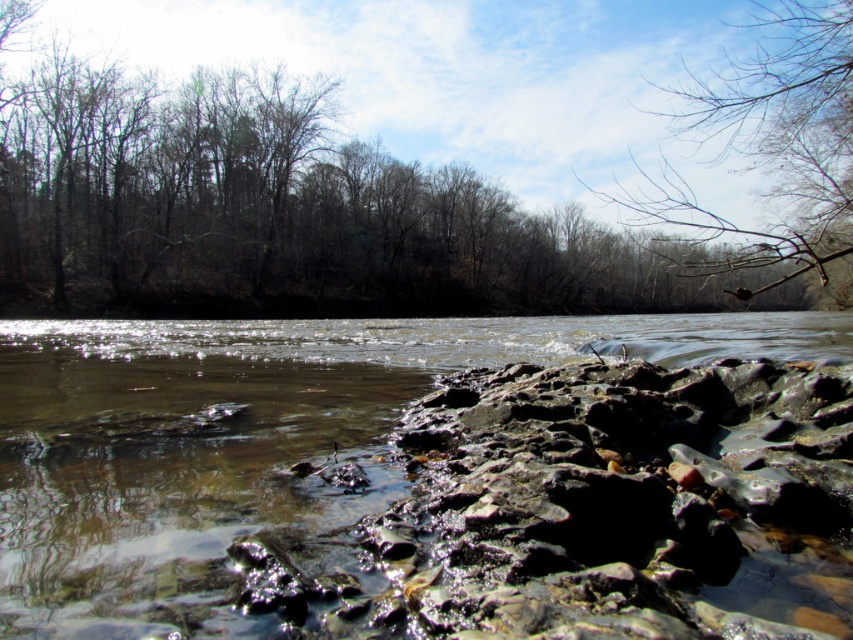
You are standing at the edge of the river and want to reach a specific point in the water marked at coordinates point (613, 538). If your maximum wading depth is 1.5 meters, can you safely reach that point without getting deeper than your limit?

The distance of point (613, 538) from viewer is 4.83 meters. Since the distance is greater than the maximum wading depth of 1.5 meters, you cannot safely reach that point without exceeding your depth limit.

You are standing at the edge of the river and see two points in the scene. The first point is at coordinates point (44, 508) and the second is at point (785, 170). Which point is closer to you?

Point (44, 508) is closer to the camera than point (785, 170), so the first point is closer to you.

You are an artist sketching the scene and want to draw the brown leafless trees at upper center and the bare branches at upper right. Which object should you draw first to maintain proper perspective?

You should draw the brown leafless trees at upper center first because they are closer to the viewer than the bare branches at upper right, so they should be placed in front in your sketch.